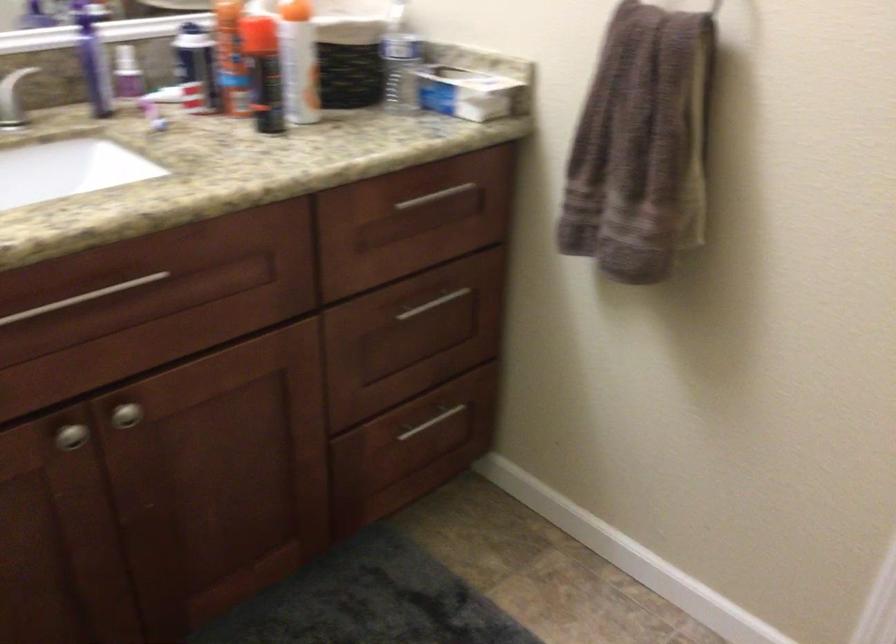
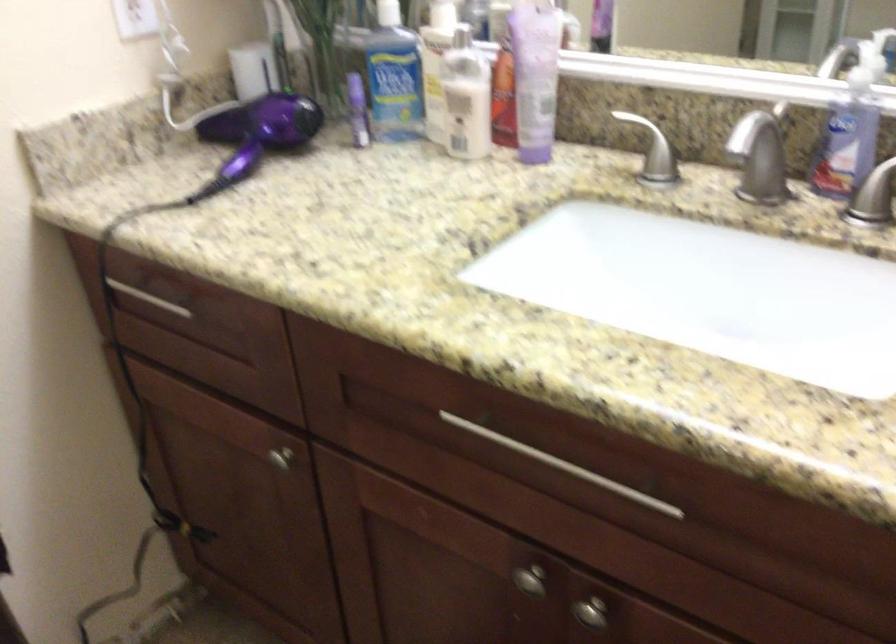
In the second image, find the point that corresponds to [80,431] in the first image.

(530, 580)